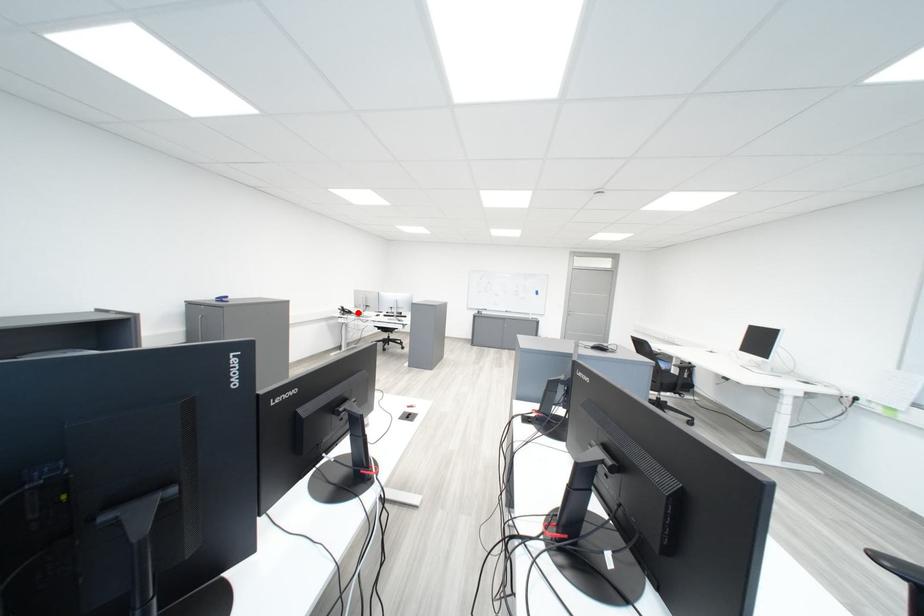
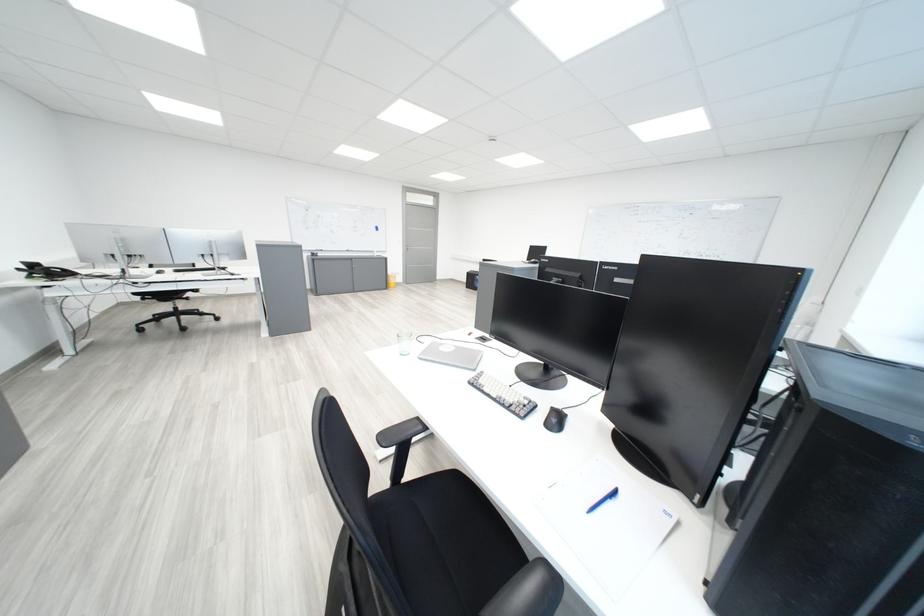
Question: A red point is marked in image1. In image2, is the corresponding 3D point closer to the camera or farther? Reply with the corresponding letter.

Choices:
 (A) The corresponding 3D point is closer.
 (B) The corresponding 3D point is farther.

Answer: (B)